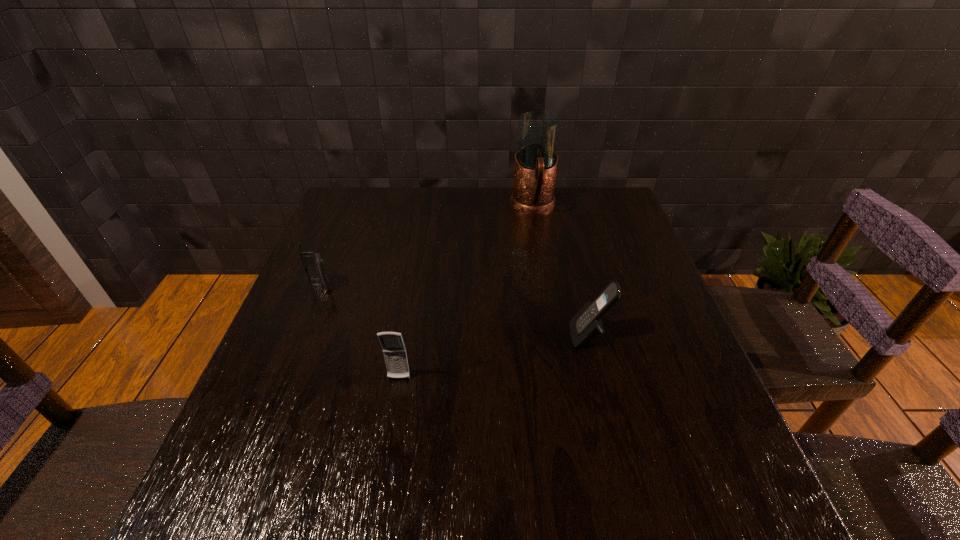
Find the location of a particular element. free point between the farthest cellular telephone and the tallest object is located at coordinates (427, 247).

Find the location of a particular element. The width and height of the screenshot is (960, 540). blank region between the third object from right to left and the pitcher is located at coordinates (466, 293).

Locate an element on the screen. The height and width of the screenshot is (540, 960). empty space between the shortest object and the rightmost cellular telephone is located at coordinates coord(455,312).

Locate an element on the screen. blank region between the second farthest cellular telephone and the farthest object is located at coordinates (561, 272).

The width and height of the screenshot is (960, 540). Identify the location of vacant area between the rightmost cellular telephone and the nearest cellular telephone. 494,358.

The width and height of the screenshot is (960, 540). I want to click on unoccupied position between the second nearest object and the leftmost object, so click(x=455, y=312).

The height and width of the screenshot is (540, 960). I want to click on vacant point located between the second cellular telephone from right to left and the pitcher, so click(466, 293).

Find the location of a particular element. The height and width of the screenshot is (540, 960). unoccupied area between the second farthest cellular telephone and the pitcher is located at coordinates (561, 272).

Locate an element on the screen. The width and height of the screenshot is (960, 540). free area in between the shortest cellular telephone and the nearest cellular telephone is located at coordinates [x=360, y=333].

Identify the location of vacant area that lies between the farthest object and the second nearest cellular telephone. The height and width of the screenshot is (540, 960). (561, 272).